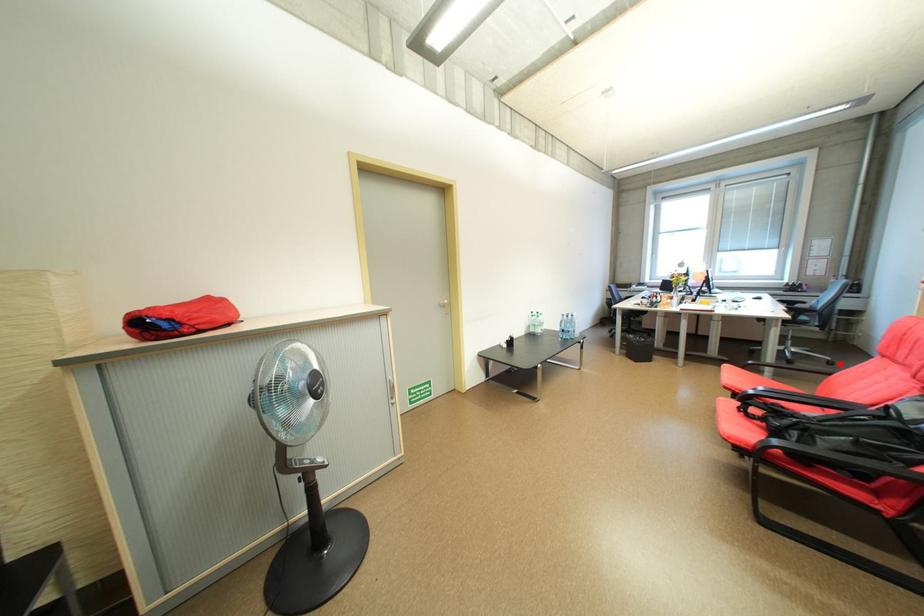
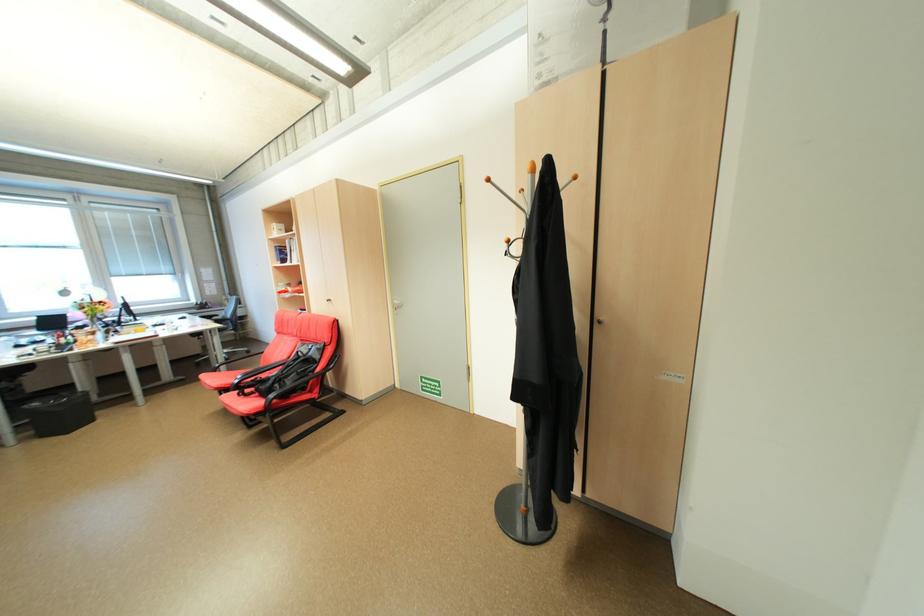
Locate, in the second image, the point that corresponds to the highlighted location in the first image.

(257, 353)